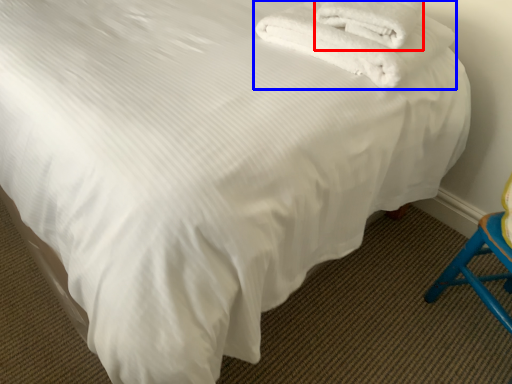
Question: Which point is closer to the camera, towel (highlighted by a red box) or towel (highlighted by a blue box)?

Choices:
 (A) towel
 (B) towel

Answer: (B)